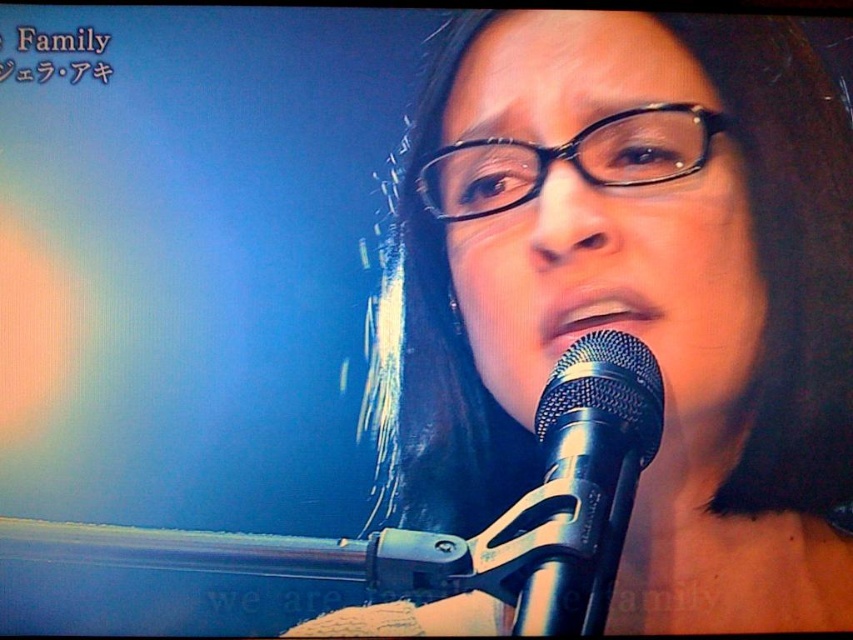
Does matte black microphone at center appear over black plastic glasses at center?

No, matte black microphone at center is not above black plastic glasses at center.

Does matte black microphone at center lie in front of black plastic glasses at center?

That is True.

Find the location of a particular element. matte black microphone at center is located at coordinates (642, 296).

Based on the photo, is matte black microphone at center wider than black metallic microphone at lower center?

Indeed, matte black microphone at center has a greater width compared to black metallic microphone at lower center.

Is matte black microphone at center to the left of black metallic microphone at lower center from the viewer's perspective?

No, matte black microphone at center is not to the left of black metallic microphone at lower center.

Measure the distance between matte black microphone at center and camera.

A distance of 4.40 feet exists between matte black microphone at center and camera.

At what (x,y) coordinates should I click in order to perform the action: click on matte black microphone at center. Please return your answer as a coordinate pair (x, y). The height and width of the screenshot is (640, 853). Looking at the image, I should click on (642, 296).

Is point (537, 420) positioned before point (636, 144)?

Yes, it is.

Is black metallic microphone at lower center taller than black plastic glasses at center?

Yes, black metallic microphone at lower center is taller than black plastic glasses at center.

Who is more forward, [556,497] or [459,220]?

Positioned in front is point [556,497].

At what (x,y) coordinates should I click in order to perform the action: click on black metallic microphone at lower center. Please return your answer as a coordinate pair (x, y). The image size is (853, 640). Looking at the image, I should click on (585, 481).